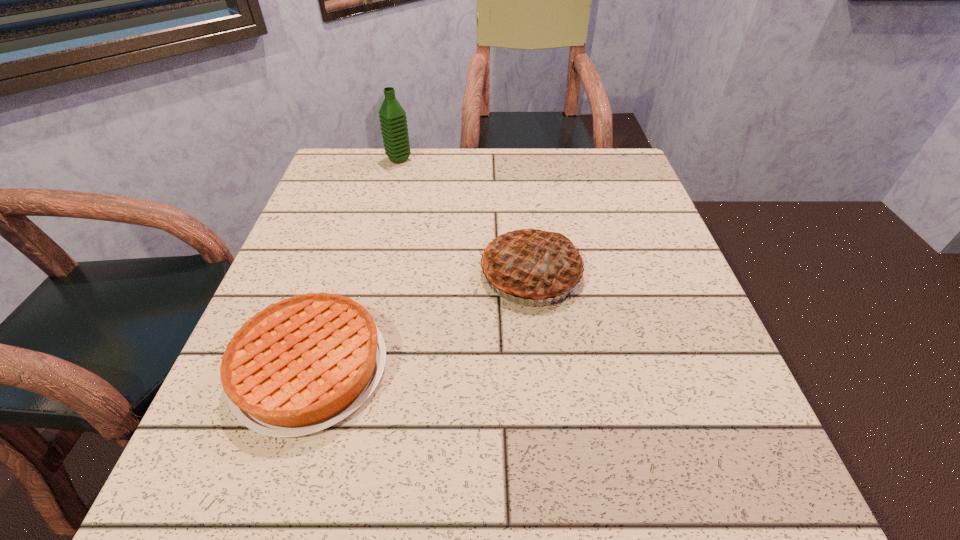
I want to click on object identified as the closest to the tallest object, so click(531, 263).

At what (x,y) coordinates should I click in order to perform the action: click on vacant area in the image that satisfies the following two spatial constraints: 1. on the back side of the farthest object; 2. on the right side of the shorter pie. Please return your answer as a coordinate pair (x, y). The width and height of the screenshot is (960, 540). Looking at the image, I should click on (377, 159).